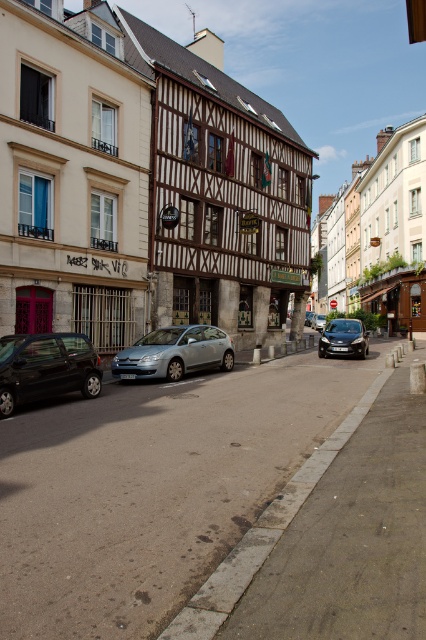
Is shiny black car at lower left positioned behind satin black car at center?

That is False.

The image size is (426, 640). Identify the location of shiny black car at lower left. (46, 368).

Does white wooden building at center have a greater height compared to shiny black car at lower left?

Yes, white wooden building at center is taller than shiny black car at lower left.

Is point (368, 208) positioned behind point (80, 348)?

That is True.

Locate an element on the screen. The width and height of the screenshot is (426, 640). white wooden building at center is located at coordinates (377, 232).

Based on the photo, can you confirm if shiny black car at lower left is bigger than satin silver car at center?

No, shiny black car at lower left is not bigger than satin silver car at center.

Who is more forward, (x=43, y=362) or (x=172, y=356)?

Point (x=43, y=362) is more forward.

Identify the location of shiny black car at lower left. The width and height of the screenshot is (426, 640). (46, 368).